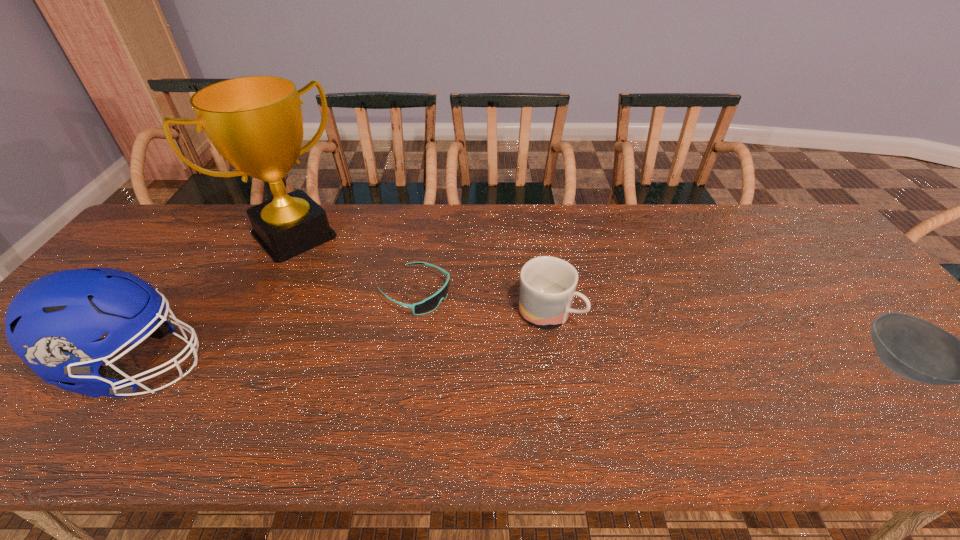
Where is `unoccupied position between the sunglasses and the tallest object`? unoccupied position between the sunglasses and the tallest object is located at coordinates (354, 264).

Where is `unoccupied position between the fourth shortest object and the tallest object`? This screenshot has width=960, height=540. unoccupied position between the fourth shortest object and the tallest object is located at coordinates (217, 301).

Locate which object ranks third in proximity to the bowl. Please provide its 2D coordinates. Your answer should be formatted as a tuple, i.e. [(x, y)], where the tuple contains the x and y coordinates of a point satisfying the conditions above.

[(255, 122)]

Identify which object is the second nearest to the football helmet. Please provide its 2D coordinates. Your answer should be formatted as a tuple, i.e. [(x, y)], where the tuple contains the x and y coordinates of a point satisfying the conditions above.

[(429, 304)]

Image resolution: width=960 pixels, height=540 pixels. Find the location of `blank space that satisfies the following two spatial constraints: 1. on the front side of the third object from left to right; 2. on the left side of the third tallest object`. blank space that satisfies the following two spatial constraints: 1. on the front side of the third object from left to right; 2. on the left side of the third tallest object is located at coordinates (411, 313).